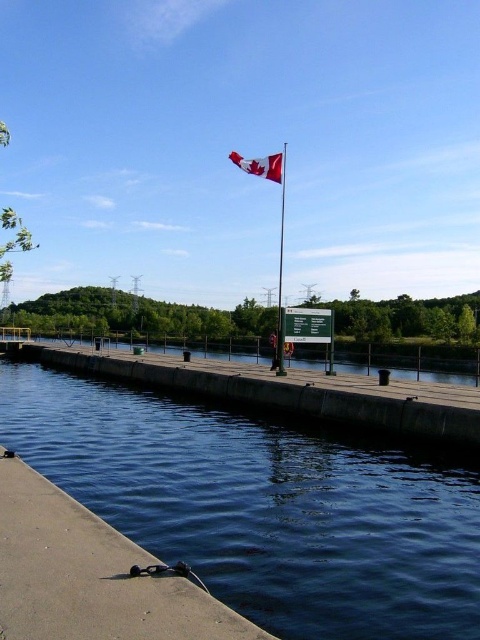
Question: Can you confirm if concrete dock at lower left is smaller than concrete dock at center?

Choices:
 (A) yes
 (B) no

Answer: (A)

Question: Can you confirm if dark blue concrete at lower left is smaller than concrete dock at center?

Choices:
 (A) no
 (B) yes

Answer: (B)

Question: Which of the following is the farthest from the observer?

Choices:
 (A) (260, 166)
 (B) (233, 624)

Answer: (A)

Question: Which object appears farthest from the camera in this image?

Choices:
 (A) polished metal flag pole at upper center
 (B) concrete dock at center
 (C) dark blue concrete at lower left
 (D) concrete dock at lower left

Answer: (A)

Question: Among these points, which one is nearest to the camera?

Choices:
 (A) (456, 602)
 (B) (280, 332)
 (C) (285, 410)

Answer: (A)

Question: In this image, where is dark blue concrete at lower left located relative to polished metal flag pole at upper center?

Choices:
 (A) above
 (B) below

Answer: (B)